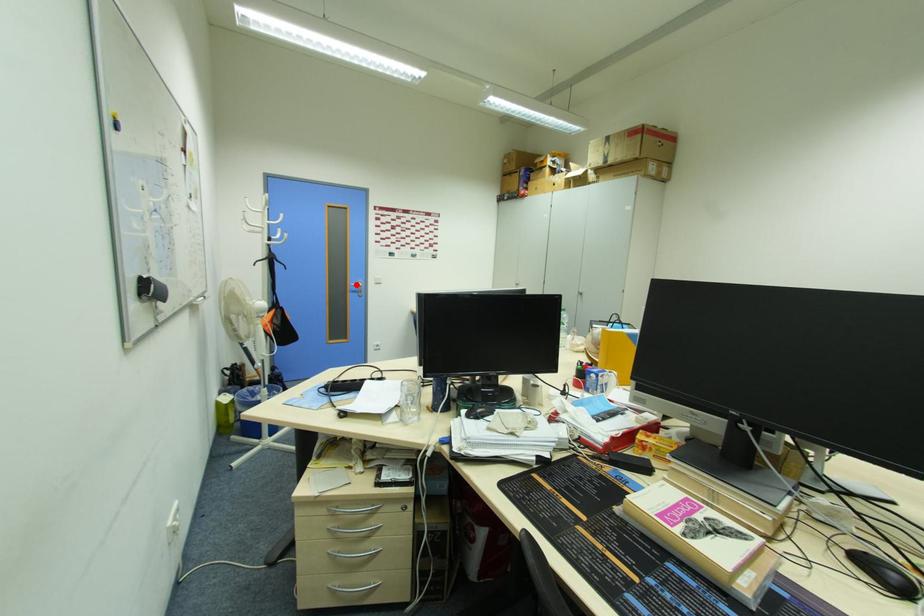
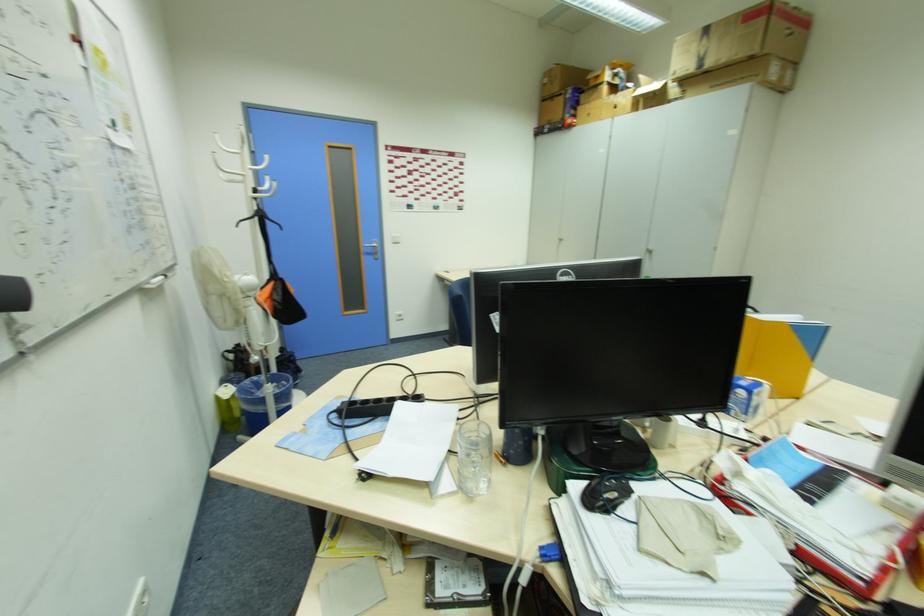
Question: I am providing you with two images of the same scene from different viewpoints. A red point is shown in image1. For the corresponding object point in image2, is it positioned nearer or farther from the camera?

Choices:
 (A) Nearer
 (B) Farther

Answer: (A)